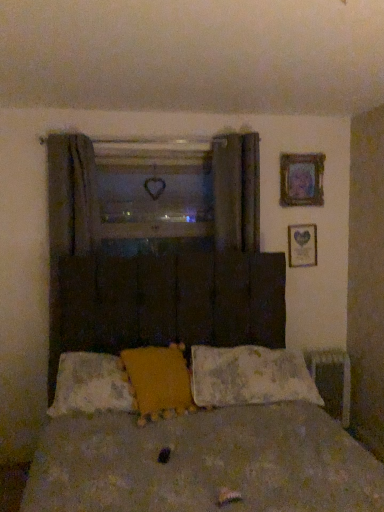
Locate an element on the screen. Image resolution: width=384 pixels, height=512 pixels. wooden picture frame at upper right, which is the second picture frame in bottom-to-top order is located at coordinates (301, 179).

Measure the distance between point [246,226] and camera.

2.83 meters.

The image size is (384, 512). What do you see at coordinates (302, 245) in the screenshot?
I see `wooden picture frame at upper right, the first picture frame positioned from the bottom` at bounding box center [302, 245].

This screenshot has width=384, height=512. Describe the element at coordinates (199, 442) in the screenshot. I see `textured brown bed at center` at that location.

This screenshot has height=512, width=384. Identify the location of fluffy white pillow at center, which appears as the 3th pillow when viewed from the left. tap(249, 376).

From the image's perspective, which one is positioned higher, fluffy white pillow at center, which appears as the 3th pillow when viewed from the left, or wooden picture frame at upper right, the first picture frame positioned from the bottom?

From the image's view, wooden picture frame at upper right, the first picture frame positioned from the bottom, is above.

From the image's perspective, count 1st picture frames upward from the fluffy white pillow at center, acting as the first pillow starting from the right, and point to it. Please provide its 2D coordinates.

[(302, 245)]

Can you confirm if fluffy white pillow at center, acting as the first pillow starting from the right, is taller than wooden picture frame at upper right, the first picture frame positioned from the bottom?

No.

In the scene shown: Could you tell me if fluffy white pillow at center, which appears as the 3th pillow when viewed from the left, is facing wooden picture frame at upper right, the first picture frame positioned from the bottom?

No, fluffy white pillow at center, which appears as the 3th pillow when viewed from the left, is not oriented towards wooden picture frame at upper right, the first picture frame positioned from the bottom.

How distant is dark fabric curtain at upper center, which is counted as the first curtain, starting from the right, from fluffy white pillow at center, acting as the 3th pillow starting from the right?

dark fabric curtain at upper center, which is counted as the first curtain, starting from the right, is 4.07 feet away from fluffy white pillow at center, acting as the 3th pillow starting from the right.

Can we say dark fabric curtain at upper center, which appears as the 2th curtain when viewed from the left, lies outside fluffy white pillow at center, which is counted as the first pillow, starting from the left?

Yes, dark fabric curtain at upper center, which appears as the 2th curtain when viewed from the left, is located beyond the bounds of fluffy white pillow at center, which is counted as the first pillow, starting from the left.

Does dark fabric curtain at upper center, which appears as the 2th curtain when viewed from the left, appear on the left side of fluffy white pillow at center, which is counted as the first pillow, starting from the left?

Incorrect, dark fabric curtain at upper center, which appears as the 2th curtain when viewed from the left, is not on the left side of fluffy white pillow at center, which is counted as the first pillow, starting from the left.

From the picture: Can you confirm if textured brown bed at center is shorter than fluffy white pillow at center, acting as the 3th pillow starting from the right?

No.

Considering the positions of points (183, 449) and (101, 394), is point (183, 449) closer to camera compared to point (101, 394)?

Yes, point (183, 449) is closer to viewer.

Would you say textured brown bed at center is a long distance from fluffy white pillow at center, acting as the 3th pillow starting from the right?

textured brown bed at center is near fluffy white pillow at center, acting as the 3th pillow starting from the right, not far away.

Is wooden picture frame at upper right, which is the 1th picture frame from top to bottom, not close to wooden frame at center?

No, wooden picture frame at upper right, which is the 1th picture frame from top to bottom, is not far from wooden frame at center.

Is the depth of wooden picture frame at upper right, which is the second picture frame in bottom-to-top order, less than that of wooden frame at center?

That is False.

Is wooden picture frame at upper right, which is the 1th picture frame from top to bottom, completely or partially outside of wooden frame at center?

Yes, wooden picture frame at upper right, which is the 1th picture frame from top to bottom, is not within wooden frame at center.

How far apart are wooden picture frame at upper right, which is the second picture frame in bottom-to-top order, and wooden frame at center?

32.59 inches.

Is textured brown bed at center beside wooden picture frame at upper right, placed as the second picture frame when sorted from top to bottom?

No.

From a real-world perspective, is textured brown bed at center located higher than wooden picture frame at upper right, the first picture frame positioned from the bottom?

No, from a real-world perspective, textured brown bed at center is not on top of wooden picture frame at upper right, the first picture frame positioned from the bottom.

Looking at their sizes, would you say textured brown bed at center is wider or thinner than wooden picture frame at upper right, placed as the second picture frame when sorted from top to bottom?

Clearly, textured brown bed at center has more width compared to wooden picture frame at upper right, placed as the second picture frame when sorted from top to bottom.

Is fluffy white pillow at center, which appears as the 3th pillow when viewed from the left, positioned with its back to wooden frame at center?

No, fluffy white pillow at center, which appears as the 3th pillow when viewed from the left, is not facing the opposite direction of wooden frame at center.

Would you say fluffy white pillow at center, acting as the first pillow starting from the right, contains wooden frame at center?

Actually, wooden frame at center is outside fluffy white pillow at center, acting as the first pillow starting from the right.

Looking at this image, from a real-world perspective, does fluffy white pillow at center, which appears as the 3th pillow when viewed from the left, stand above wooden frame at center?

Actually, fluffy white pillow at center, which appears as the 3th pillow when viewed from the left, is physically below wooden frame at center in the real world.

Which is closer to the camera, (237, 181) or (227, 398)?

The point (227, 398) is in front.

Looking at this image, from a real-world perspective, is dark fabric curtain at upper center, which is counted as the first curtain, starting from the right, positioned above or below fluffy white pillow at center, acting as the first pillow starting from the right?

From a real-world perspective, dark fabric curtain at upper center, which is counted as the first curtain, starting from the right, is physically above fluffy white pillow at center, acting as the first pillow starting from the right.

Is dark fabric curtain at upper center, which appears as the 2th curtain when viewed from the left, facing away from fluffy white pillow at center, which appears as the 3th pillow when viewed from the left?

No, dark fabric curtain at upper center, which appears as the 2th curtain when viewed from the left, is not facing away from fluffy white pillow at center, which appears as the 3th pillow when viewed from the left.

Is dark fabric curtain at upper center, which is counted as the first curtain, starting from the right, in front of or behind fluffy white pillow at center, acting as the first pillow starting from the right, in the image?

In the image, dark fabric curtain at upper center, which is counted as the first curtain, starting from the right, appears behind fluffy white pillow at center, acting as the first pillow starting from the right.

From a real-world perspective, which picture frame is the 1st one above the fluffy white pillow at center, acting as the first pillow starting from the right? Please provide its 2D coordinates.

[(302, 245)]

Which pillow is the 2nd one when counting from the left side of the dark fabric curtain at upper center, which is counted as the first curtain, starting from the right? Please provide its 2D coordinates.

[(91, 385)]

Based on their spatial positions, is fluffy white pillow at center, acting as the 3th pillow starting from the right, or textured brown bed at center closer to dark gray fabric curtain at left, which ranks as the 2th curtain in right-to-left order?

Among the two, fluffy white pillow at center, acting as the 3th pillow starting from the right, is located nearer to dark gray fabric curtain at left, which ranks as the 2th curtain in right-to-left order.

Which object lies nearer to the anchor point yellow fabric pillow at center, which ranks as the 2th pillow in right-to-left order, dark gray fabric curtain at left, which ranks as the 2th curtain in right-to-left order, or wooden picture frame at upper right, the first picture frame positioned from the bottom?

dark gray fabric curtain at left, which ranks as the 2th curtain in right-to-left order, is closer to yellow fabric pillow at center, which ranks as the 2th pillow in right-to-left order.

From the image, which object appears to be nearer to yellow fabric pillow at center, positioned as the 2th pillow in left-to-right order, dark fabric curtain at upper center, which is counted as the first curtain, starting from the right, or fluffy white pillow at center, acting as the first pillow starting from the right?

fluffy white pillow at center, acting as the first pillow starting from the right.

Looking at the image, which one is located further to wooden frame at center, yellow fabric pillow at center, which ranks as the 2th pillow in right-to-left order, or wooden picture frame at upper right, placed as the second picture frame when sorted from top to bottom?

yellow fabric pillow at center, which ranks as the 2th pillow in right-to-left order, lies further to wooden frame at center than the other object.

Estimate the real-world distances between objects in this image. Which object is closer to fluffy white pillow at center, which is counted as the first pillow, starting from the left, wooden frame at center or yellow fabric pillow at center, positioned as the 2th pillow in left-to-right order?

yellow fabric pillow at center, positioned as the 2th pillow in left-to-right order, lies closer to fluffy white pillow at center, which is counted as the first pillow, starting from the left, than the other object.

From the image, which object appears to be farther from textured brown bed at center, dark gray fabric curtain at left, which ranks as the 2th curtain in right-to-left order, or wooden picture frame at upper right, which is the second picture frame in bottom-to-top order?

The object further to textured brown bed at center is wooden picture frame at upper right, which is the second picture frame in bottom-to-top order.

Looking at the image, which one is located further to dark gray fabric curtain at left, the 1th curtain positioned from the left, wooden picture frame at upper right, placed as the second picture frame when sorted from top to bottom, or metallic gray radiator at lower right?

metallic gray radiator at lower right.

Consider the image. Considering their positions, is wooden picture frame at upper right, the first picture frame positioned from the bottom, positioned closer to fluffy white pillow at center, which is counted as the first pillow, starting from the left, than dark gray fabric curtain at left, the 1th curtain positioned from the left?

Among the two, dark gray fabric curtain at left, the 1th curtain positioned from the left, is located nearer to fluffy white pillow at center, which is counted as the first pillow, starting from the left.

Where is `pillow between wooden frame at center and fluffy white pillow at center, acting as the 3th pillow starting from the right, vertically`? pillow between wooden frame at center and fluffy white pillow at center, acting as the 3th pillow starting from the right, vertically is located at coordinates coord(159,381).

Identify the location of window frame between wooden picture frame at upper right, which is the 1th picture frame from top to bottom, and yellow fabric pillow at center, positioned as the 2th pillow in left-to-right order, in the up-down direction. Image resolution: width=384 pixels, height=512 pixels. (154, 188).

Identify the location of curtain located between dark gray fabric curtain at left, which ranks as the 2th curtain in right-to-left order, and wooden picture frame at upper right, the first picture frame positioned from the bottom, in the left-right direction. (236, 191).

You are a GUI agent. You are given a task and a screenshot of the screen. Output one action in this format:
    pyautogui.click(x=<x>, y=<y>)
    Task: Click on the window frame between wooden picture frame at upper right, which is the second picture frame in bottom-to-top order, and metallic gray radiator at lower right in the up-down direction
    The height and width of the screenshot is (512, 384).
    Given the screenshot: What is the action you would take?
    pyautogui.click(x=154, y=188)